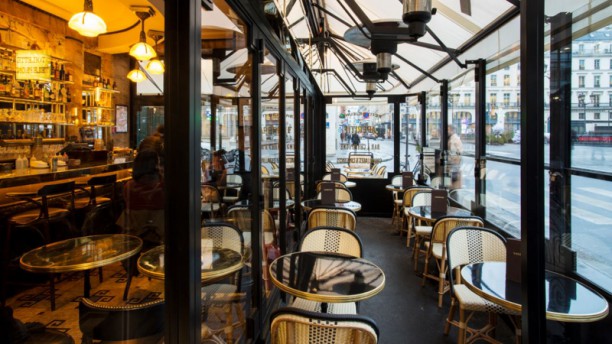
Locate an element on the screen. shelves of alcohol is located at coordinates (10, 62), (18, 89), (103, 85), (106, 100).